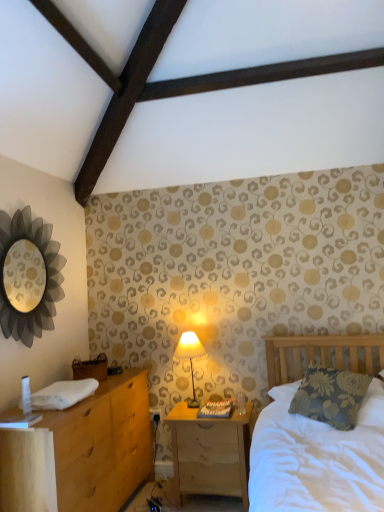
Find the location of a particular element. The image size is (384, 512). wooden nightstand at lower center is located at coordinates (210, 453).

Describe the element at coordinates (46, 276) in the screenshot. I see `metallic silver mirror at upper left` at that location.

Describe the element at coordinates (81, 452) in the screenshot. The image size is (384, 512). I see `light brown wood chest of drawers at left` at that location.

Find the location of a particular element. Image resolution: width=384 pixels, height=512 pixels. matte cream fabric lampshade at center is located at coordinates (190, 357).

What do you see at coordinates (330, 396) in the screenshot? This screenshot has width=384, height=512. I see `floral fabric pillow at right` at bounding box center [330, 396].

Find the location of a particular element. The width and height of the screenshot is (384, 512). wooden nightstand at lower center is located at coordinates (210, 453).

Does point (294, 395) appear closer or farther from the camera than point (101, 450)?

Point (294, 395) is farther from the camera than point (101, 450).

From a real-world perspective, is floral fabric pillow at right physically located above or below light brown wood chest of drawers at left?

floral fabric pillow at right is situated higher than light brown wood chest of drawers at left in the real world.

Does floral fabric pillow at right have a larger size compared to light brown wood chest of drawers at left?

No.

From the image's perspective, relative to metallic silver mirror at upper left, is floral fabric pillow at right above or below?

floral fabric pillow at right is situated lower than metallic silver mirror at upper left in the image.

Is floral fabric pillow at right turned away from metallic silver mirror at upper left?

floral fabric pillow at right is not turned away from metallic silver mirror at upper left.

What are the coordinates of `mirror behind the floral fabric pillow at right` in the screenshot? It's located at (46, 276).

Can you confirm if floral fabric pillow at right is wider than metallic silver mirror at upper left?

→ Correct, the width of floral fabric pillow at right exceeds that of metallic silver mirror at upper left.

Identify the location of pillow lying on the right of light brown wood chest of drawers at left. This screenshot has width=384, height=512. (330, 396).

Is light brown wood chest of drawers at left facing away from floral fabric pillow at right?

light brown wood chest of drawers at left does not have its back to floral fabric pillow at right.

Considering the sizes of objects light brown wood chest of drawers at left and floral fabric pillow at right in the image provided, who is shorter, light brown wood chest of drawers at left or floral fabric pillow at right?

floral fabric pillow at right is shorter.

From the image's perspective, relative to floral fabric pillow at right, is light brown wood chest of drawers at left above or below?

light brown wood chest of drawers at left is below floral fabric pillow at right.

Based on the photo, can you confirm if light brown wood chest of drawers at left is positioned to the right of wooden nightstand at lower center?

Incorrect, light brown wood chest of drawers at left is not on the right side of wooden nightstand at lower center.

Can you confirm if light brown wood chest of drawers at left is bigger than wooden nightstand at lower center?

Indeed, light brown wood chest of drawers at left has a larger size compared to wooden nightstand at lower center.

Considering their positions, is light brown wood chest of drawers at left located in front of or behind wooden nightstand at lower center?

Clearly, light brown wood chest of drawers at left is in front of wooden nightstand at lower center.

From the image's perspective, is light brown wood chest of drawers at left located above wooden nightstand at lower center?

Yes, from the image's perspective, light brown wood chest of drawers at left is above wooden nightstand at lower center.

From the image's perspective, is light brown wood chest of drawers at left on metallic silver mirror at upper left?

No.

Is light brown wood chest of drawers at left positioned beyond the bounds of metallic silver mirror at upper left?

light brown wood chest of drawers at left is positioned outside metallic silver mirror at upper left.

Which of these two, light brown wood chest of drawers at left or metallic silver mirror at upper left, is thinner?

Thinner between the two is metallic silver mirror at upper left.

Between point (179, 454) and point (81, 470), which one is positioned behind?

The point (179, 454) is behind.

From the image's perspective, which one is positioned lower, wooden nightstand at lower center or light brown wood chest of drawers at left?

wooden nightstand at lower center appears lower in the image.

Does wooden nightstand at lower center have a lesser height compared to light brown wood chest of drawers at left?

Yes, wooden nightstand at lower center is shorter than light brown wood chest of drawers at left.

Which object is more forward, wooden nightstand at lower center or light brown wood chest of drawers at left?

light brown wood chest of drawers at left.

Is metallic silver mirror at upper left further to the viewer compared to floral fabric pillow at right?

Yes, the depth of metallic silver mirror at upper left is greater than that of floral fabric pillow at right.

In the scene shown: Which of these two, metallic silver mirror at upper left or floral fabric pillow at right, is thinner?

Thinner between the two is metallic silver mirror at upper left.

Which is behind, point (36, 228) or point (314, 373)?

The point (36, 228) is farther from the camera.

Consider the image. Which is more to the right, metallic silver mirror at upper left or floral fabric pillow at right?

From the viewer's perspective, floral fabric pillow at right appears more on the right side.

The height and width of the screenshot is (512, 384). In the image, there is a floral fabric pillow at right. In order to click on the chest of drawers below it (from a real-world perspective) in this screenshot , I will do pyautogui.click(x=81, y=452).

The height and width of the screenshot is (512, 384). Identify the location of pillow located on the right of metallic silver mirror at upper left. (330, 396).

When comparing their distances from light brown wood chest of drawers at left, does floral fabric pillow at right or wooden nightstand at lower center seem closer?

The object closer to light brown wood chest of drawers at left is wooden nightstand at lower center.

Based on their spatial positions, is matte cream fabric lampshade at center or metallic silver mirror at upper left further from floral fabric pillow at right?

Among the two, metallic silver mirror at upper left is located further to floral fabric pillow at right.

Looking at the image, which one is located closer to light brown wood chest of drawers at left, wooden nightstand at lower center or floral fabric pillow at right?

The object closer to light brown wood chest of drawers at left is wooden nightstand at lower center.

When comparing their distances from wooden nightstand at lower center, does matte cream fabric lampshade at center or metallic silver mirror at upper left seem closer?

matte cream fabric lampshade at center.

Based on their spatial positions, is metallic silver mirror at upper left or matte cream fabric lampshade at center closer to wooden nightstand at lower center?

Among the two, matte cream fabric lampshade at center is located nearer to wooden nightstand at lower center.

Estimate the real-world distances between objects in this image. Which object is further from matte cream fabric lampshade at center, light brown wood chest of drawers at left or metallic silver mirror at upper left?

metallic silver mirror at upper left lies further to matte cream fabric lampshade at center than the other object.

Considering their positions, is floral fabric pillow at right positioned closer to metallic silver mirror at upper left than matte cream fabric lampshade at center?

The object closer to metallic silver mirror at upper left is matte cream fabric lampshade at center.

Considering their positions, is matte cream fabric lampshade at center positioned further to wooden nightstand at lower center than light brown wood chest of drawers at left?

light brown wood chest of drawers at left lies further to wooden nightstand at lower center than the other object.

Where is `table lamp located between metallic silver mirror at upper left and wooden nightstand at lower center in the left-right direction`? The width and height of the screenshot is (384, 512). table lamp located between metallic silver mirror at upper left and wooden nightstand at lower center in the left-right direction is located at coordinates (190, 357).

Locate an element on the screen. This screenshot has height=512, width=384. table lamp between light brown wood chest of drawers at left and floral fabric pillow at right is located at coordinates (190, 357).

Locate an element on the screen. This screenshot has height=512, width=384. nightstand positioned between light brown wood chest of drawers at left and matte cream fabric lampshade at center from near to far is located at coordinates click(x=210, y=453).

At what (x,y) coordinates should I click in order to perform the action: click on nightstand between light brown wood chest of drawers at left and floral fabric pillow at right. Please return your answer as a coordinate pair (x, y). Image resolution: width=384 pixels, height=512 pixels. Looking at the image, I should click on (210, 453).